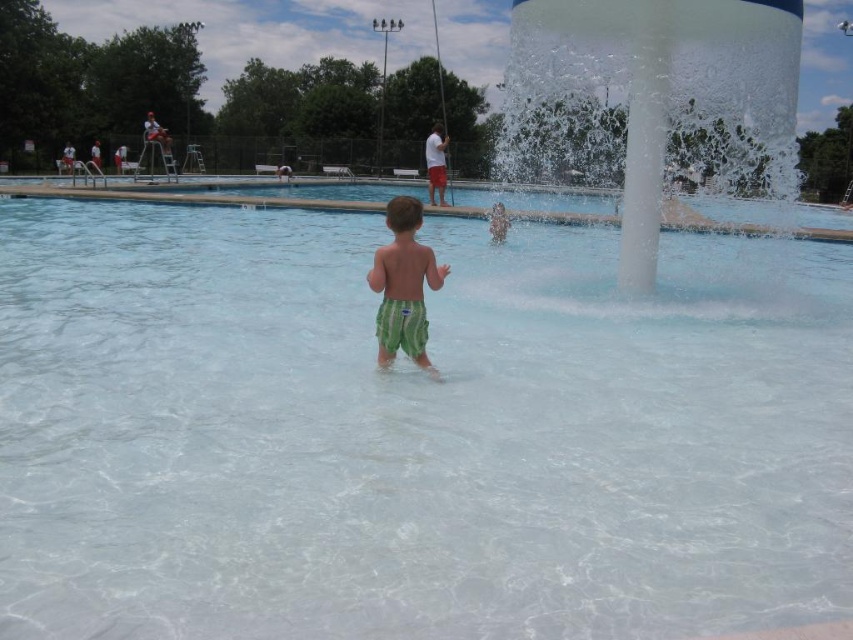
Question: Can you confirm if clear glass swimming pool at center is positioned to the left of green striped shorts at center?

Choices:
 (A) yes
 (B) no

Answer: (B)

Question: Which point is closer to the camera?

Choices:
 (A) white translucent water at center
 (B) clear glass swimming pool at center
 (C) green striped shorts at center

Answer: (B)

Question: Which of the following is the farthest from the observer?

Choices:
 (A) clear glass swimming pool at center
 (B) green striped shorts at center
 (C) white translucent water at center

Answer: (C)

Question: Is clear glass swimming pool at center bigger than green striped shorts at center?

Choices:
 (A) yes
 (B) no

Answer: (A)

Question: Is clear glass swimming pool at center to the right of green striped shorts at center from the viewer's perspective?

Choices:
 (A) yes
 (B) no

Answer: (A)

Question: Which of the following is the closest to the observer?

Choices:
 (A) (784, 192)
 (B) (761, 250)

Answer: (A)